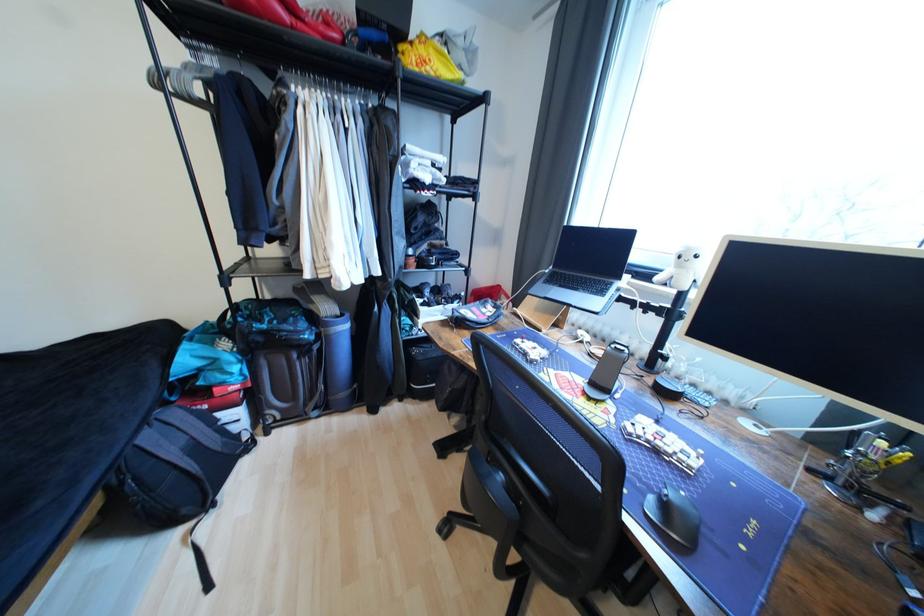
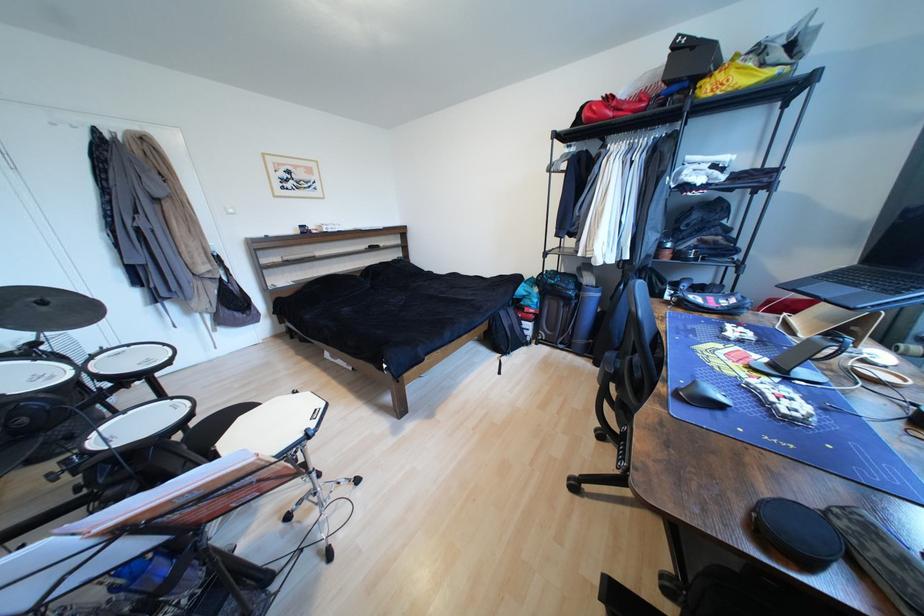
Question: The camera is either moving clockwise (left) or counter-clockwise (right) around the object. The first image is from the beginning of the video and the second image is from the end. Is the camera moving left or right when shooting the video?

Choices:
 (A) Left
 (B) Right

Answer: (B)